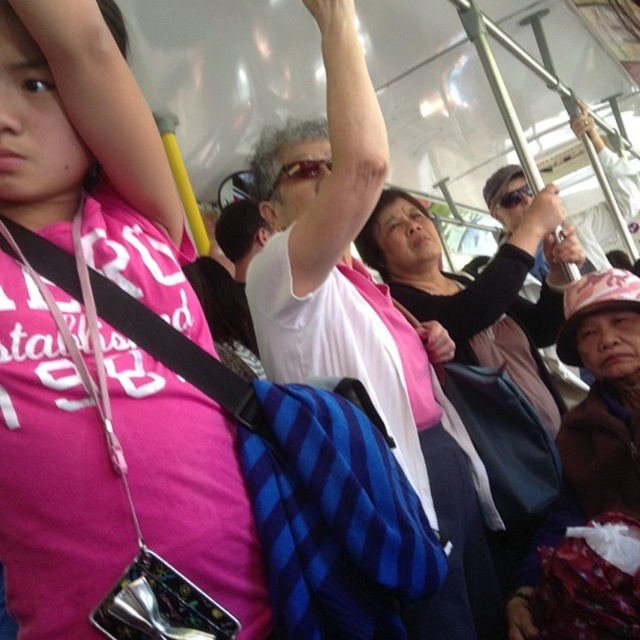
Question: Among these objects, which one is farthest from the camera?

Choices:
 (A) brown fuzzy hat at lower right
 (B) pink matte shirt at upper left

Answer: (A)

Question: In this image, where is pink matte shirt at upper left located relative to brown fuzzy hat at lower right?

Choices:
 (A) right
 (B) left

Answer: (B)

Question: Does pink matte shirt at upper left lie behind brown fuzzy hat at lower right?

Choices:
 (A) yes
 (B) no

Answer: (B)

Question: Which of the following is the farthest from the observer?

Choices:
 (A) brown fuzzy hat at lower right
 (B) pink matte shirt at upper left

Answer: (A)

Question: Does pink matte shirt at upper left come behind brown fuzzy hat at lower right?

Choices:
 (A) yes
 (B) no

Answer: (B)